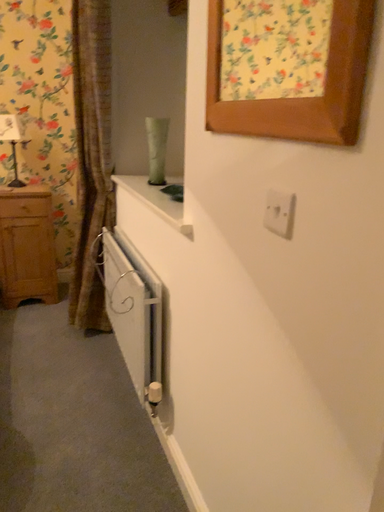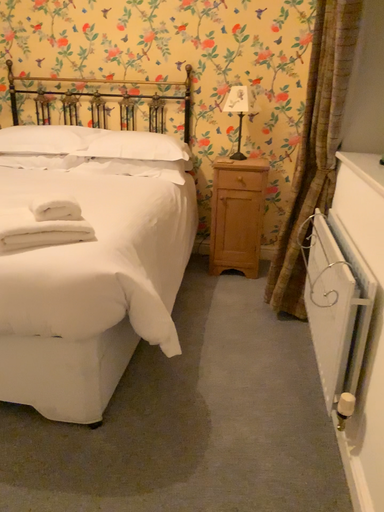
Question: How did the camera likely rotate when shooting the video?

Choices:
 (A) rotated left
 (B) rotated right

Answer: (A)